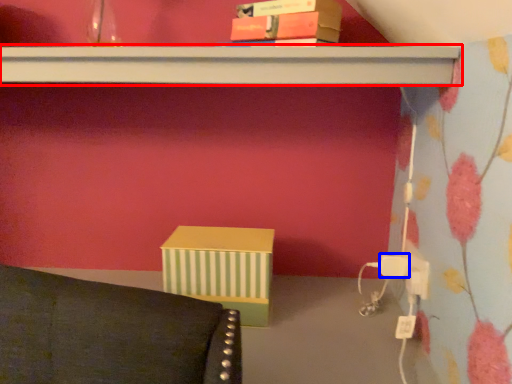
Question: Which of the following is the farthest to the observer, shelf (highlighted by a red box) or plug (highlighted by a blue box)?

Choices:
 (A) shelf
 (B) plug

Answer: (B)